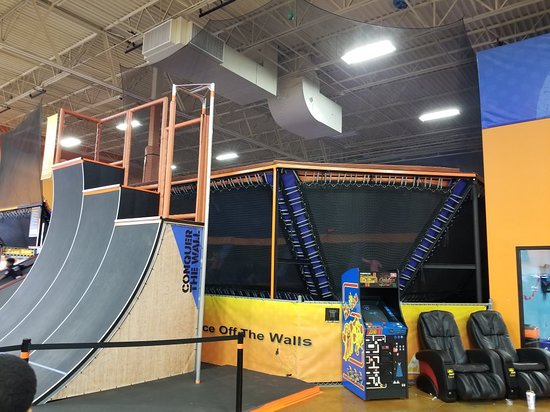
Where is `fan`? fan is located at coordinates (203, 46).